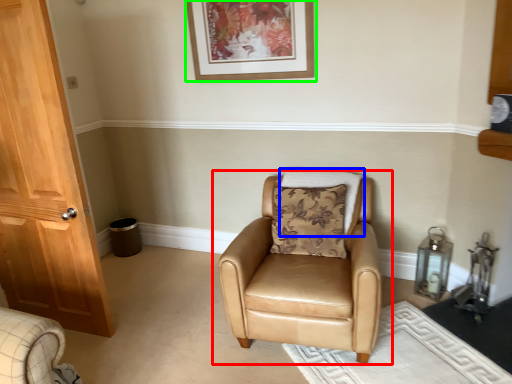
Question: Which is nearer to the chair (highlighted by a red box)? pillow (highlighted by a blue box) or picture frame (highlighted by a green box).

Choices:
 (A) pillow
 (B) picture frame

Answer: (A)